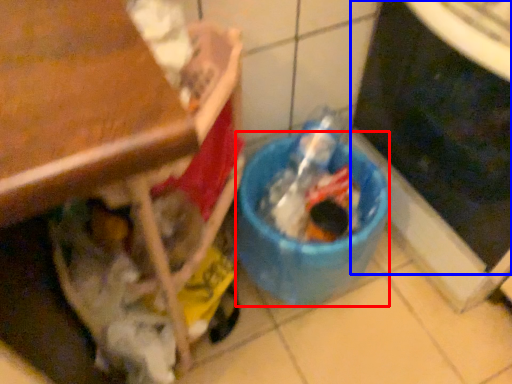
Question: Among these objects, which one is farthest to the camera, recycling bin (highlighted by a red box) or appliance (highlighted by a blue box)?

Choices:
 (A) recycling bin
 (B) appliance

Answer: (A)